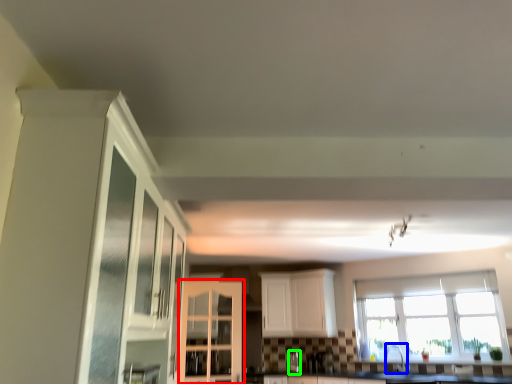
Question: Which object is positioned closest to cabinetry (highlighted by a red box)? Select from faucet (highlighted by a blue box) and silver (highlighted by a green box).

Choices:
 (A) faucet
 (B) silver

Answer: (B)